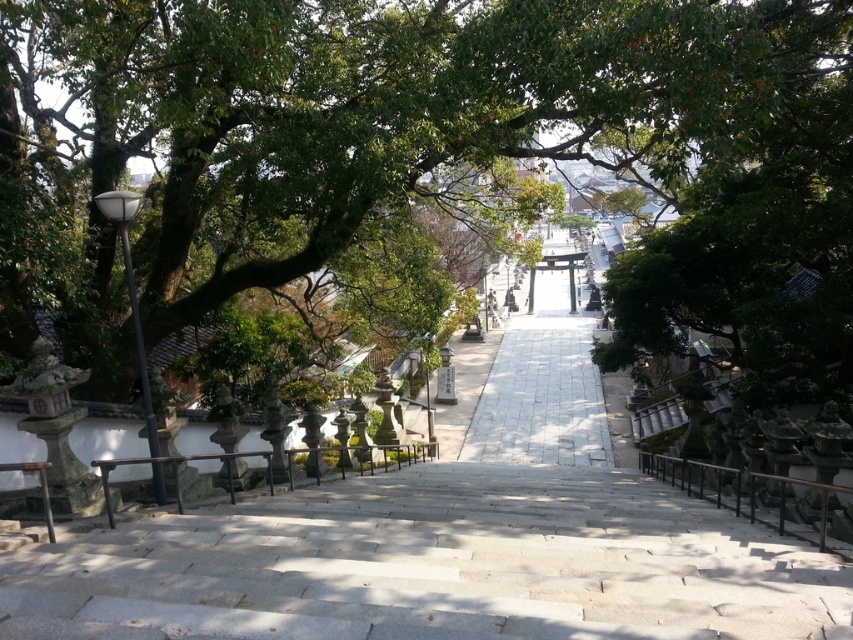
Question: Can you confirm if white stone path at center is bigger than black metal/rail at lower right?

Choices:
 (A) no
 (B) yes

Answer: (B)

Question: Does green leafy tree at center appear under white stone path at center?

Choices:
 (A) yes
 (B) no

Answer: (B)

Question: Which of the following is the closest to the observer?

Choices:
 (A) (520, 316)
 (B) (757, 502)
 (C) (16, 348)
 (D) (279, 636)

Answer: (D)

Question: Which object is the closest to the white stone path at center?

Choices:
 (A) green leafy tree at center
 (B) gray stone stairs at center

Answer: (A)

Question: Which of the following is the closest to the observer?

Choices:
 (A) black metal/rail at lower right
 (B) white stone path at center
 (C) gray stone stairs at center
 (D) green leafy tree at center

Answer: (C)

Question: Can you confirm if gray stone stairs at center is positioned above white stone path at center?

Choices:
 (A) no
 (B) yes

Answer: (A)